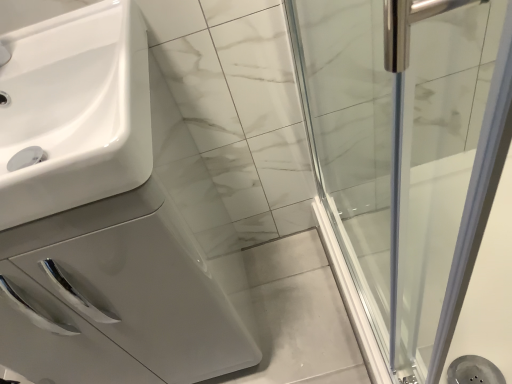
Question: Is white glossy sink at left bigger or smaller than white glossy sink at left?

Choices:
 (A) big
 (B) small

Answer: (A)

Question: From the image's perspective, is white glossy sink at left located above or below white glossy sink at left?

Choices:
 (A) above
 (B) below

Answer: (B)

Question: In the image, is white glossy sink at left positioned in front of or behind white glossy sink at left?

Choices:
 (A) front
 (B) behind

Answer: (B)

Question: Is white glossy sink at left wider or thinner than white glossy sink at left?

Choices:
 (A) wide
 (B) thin

Answer: (B)

Question: Visually, is white glossy sink at left positioned to the left or to the right of white glossy sink at left?

Choices:
 (A) left
 (B) right

Answer: (A)

Question: In terms of size, does white glossy sink at left appear bigger or smaller than white glossy sink at left?

Choices:
 (A) big
 (B) small

Answer: (B)

Question: From a real-world perspective, relative to white glossy sink at left, is white glossy sink at left vertically above or below?

Choices:
 (A) below
 (B) above

Answer: (B)